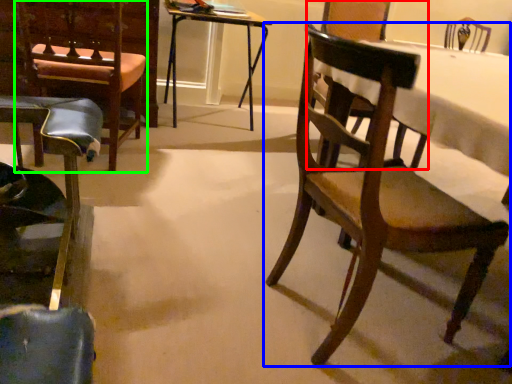
Question: Which object is positioned farthest from armchair (highlighted by a red box)? Select from chair (highlighted by a blue box) and armchair (highlighted by a green box).

Choices:
 (A) chair
 (B) armchair

Answer: (A)